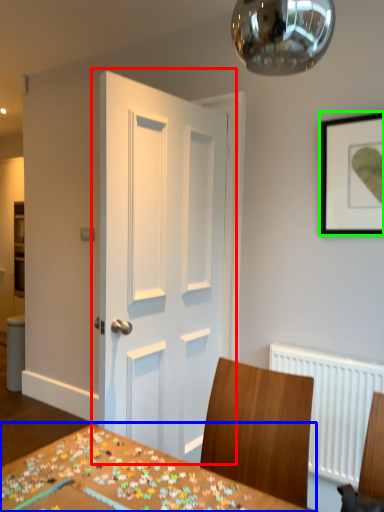
Question: Considering the real-world distances, which object is closest to door (highlighted by a red box)? table (highlighted by a blue box) or picture frame (highlighted by a green box).

Choices:
 (A) table
 (B) picture frame

Answer: (B)